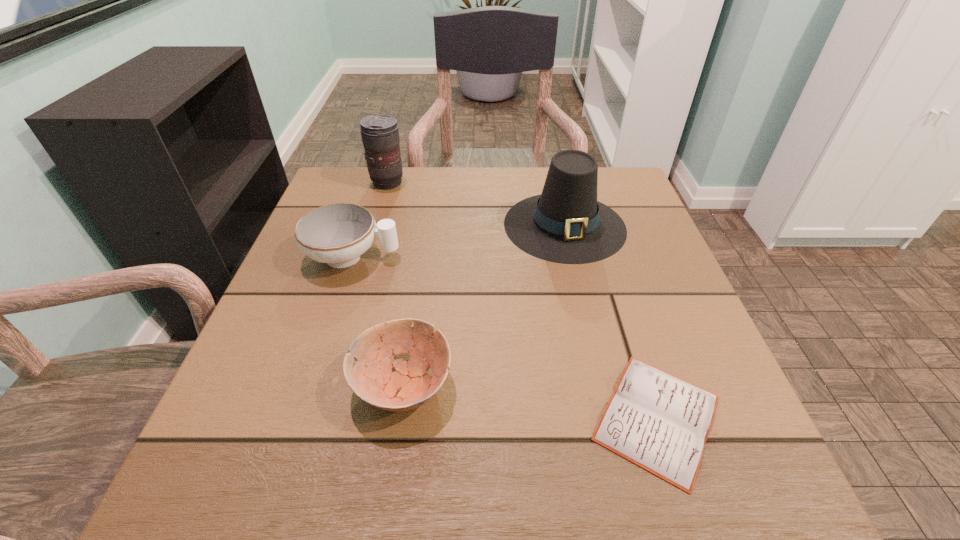
Where is `telephoto lens`? The height and width of the screenshot is (540, 960). telephoto lens is located at coordinates (380, 135).

Where is `hat`? This screenshot has height=540, width=960. hat is located at coordinates (565, 224).

The image size is (960, 540). What are the coordinates of `chinaware` in the screenshot? It's located at pyautogui.click(x=338, y=234).

You are a GUI agent. You are given a task and a screenshot of the screen. Output one action in this format:
    pyautogui.click(x=<x>, y=<y>)
    Task: Click on the bowl
    This screenshot has width=960, height=540.
    Given the screenshot: What is the action you would take?
    pyautogui.click(x=372, y=379)

The width and height of the screenshot is (960, 540). In order to click on the shortest object in this screenshot , I will do `click(659, 422)`.

The width and height of the screenshot is (960, 540). I want to click on free space located on the side of the farthest object where the control switches are located, so click(476, 183).

The height and width of the screenshot is (540, 960). I want to click on free space located on the front-facing side of the hat, so click(x=584, y=308).

Image resolution: width=960 pixels, height=540 pixels. Find the location of `free spot located on the side with the handle of the chinaware`. free spot located on the side with the handle of the chinaware is located at coordinates (569, 257).

Locate an element on the screen. Image resolution: width=960 pixels, height=540 pixels. free space located 0.240m on the back of the bowl is located at coordinates (422, 253).

Find the location of a particular element. The height and width of the screenshot is (540, 960). vacant space located on the left of the diary is located at coordinates (341, 417).